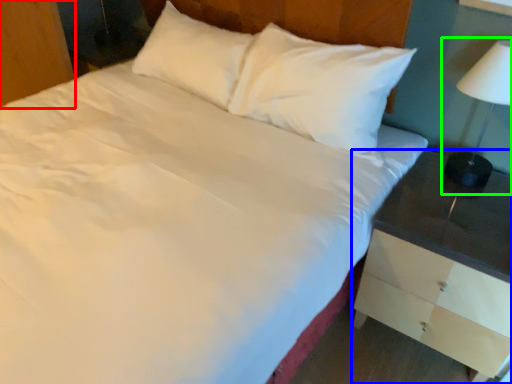
Question: Considering the real-world distances, which object is farthest from dresser (highlighted by a red box)? nightstand (highlighted by a blue box) or bedside lamp (highlighted by a green box)?

Choices:
 (A) nightstand
 (B) bedside lamp

Answer: (B)